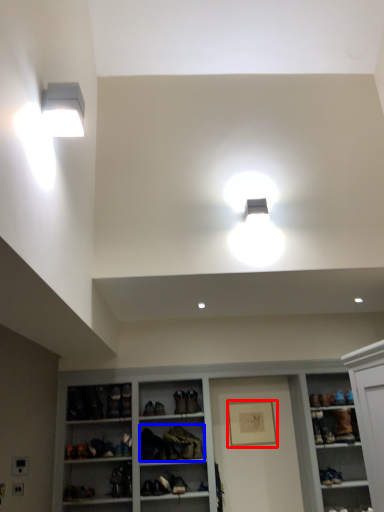
Question: Which object appears closest to the camera in this image, picture frame (highlighted by a red box) or clothing (highlighted by a blue box)?

Choices:
 (A) picture frame
 (B) clothing

Answer: (B)